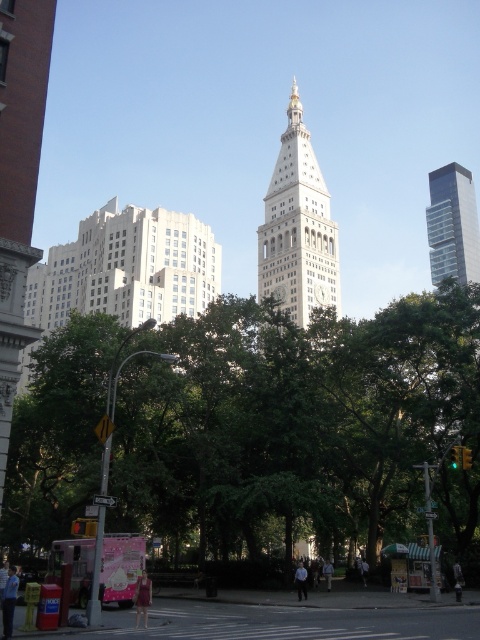
You are a GUI agent. You are given a task and a screenshot of the screen. Output one action in this format:
    pyautogui.click(x=<x>, y=<y>)
    Task: Click on the green leafy tree at center
    This screenshot has height=640, width=480.
    Given the screenshot: What is the action you would take?
    pyautogui.click(x=300, y=428)

From the picture: Is green leafy tree at center wider than white stone clock tower at center?

Yes, green leafy tree at center is wider than white stone clock tower at center.

Which is behind, point (465, 481) or point (268, 237)?

Positioned behind is point (268, 237).

I want to click on green leafy tree at center, so click(x=300, y=428).

This screenshot has height=640, width=480. I want to click on white stone clock tower at center, so click(x=298, y=227).

Where is `white stone clock tower at center`? This screenshot has height=640, width=480. white stone clock tower at center is located at coordinates (298, 227).

Locate an element on the screen. This screenshot has width=480, height=640. white stone clock tower at center is located at coordinates (298, 227).

Between white stone clock tower at center and red glass traffic light at lower left, which one is positioned lower?

red glass traffic light at lower left is below.

Can you confirm if white stone clock tower at center is thinner than red glass traffic light at lower left?

No, white stone clock tower at center is not thinner than red glass traffic light at lower left.

Is point (316, 230) closer to viewer compared to point (88, 531)?

No, (316, 230) is behind (88, 531).

Identify the location of white stone clock tower at center. The width and height of the screenshot is (480, 640). (298, 227).